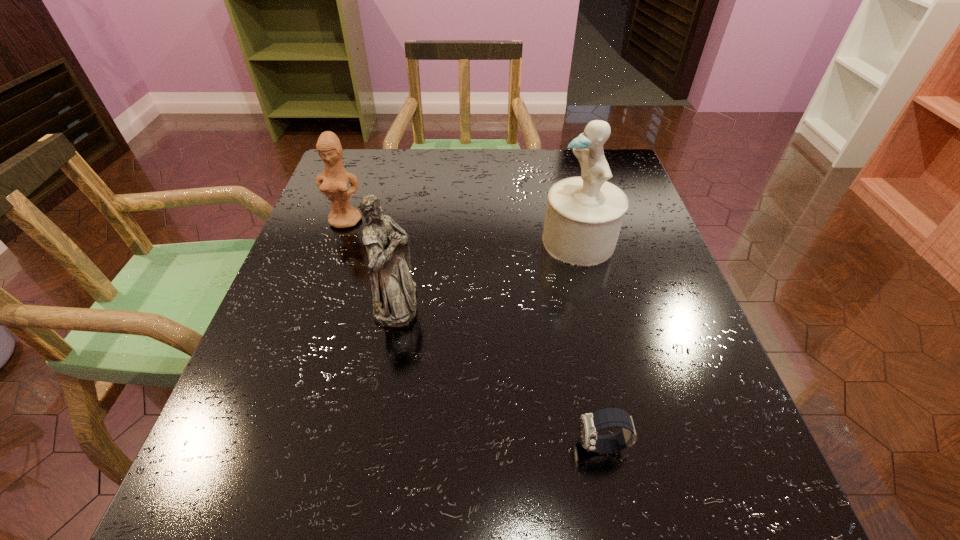
Locate an element on the screen. This screenshot has height=540, width=960. vacant area situated 0.090m on the front-facing side of the second figurine from right to left is located at coordinates (465, 302).

Locate an element on the screen. This screenshot has width=960, height=540. free space located on the front-facing side of the leftmost object is located at coordinates (332, 260).

Locate an element on the screen. The height and width of the screenshot is (540, 960). vacant space positioned on the face of the watch is located at coordinates (484, 446).

The height and width of the screenshot is (540, 960). Identify the location of free space located on the face of the watch. [x=444, y=446].

At what (x,y) coordinates should I click in order to perform the action: click on vacant space situated 0.200m on the face of the watch. Please return your answer as a coordinate pair (x, y). Looking at the image, I should click on (444, 446).

You are a GUI agent. You are given a task and a screenshot of the screen. Output one action in this format:
    pyautogui.click(x=<x>, y=<y>)
    Task: Click on the object at the left edge
    The height and width of the screenshot is (540, 960).
    Given the screenshot: What is the action you would take?
    pyautogui.click(x=333, y=183)

Find the location of a particular element. The image size is (960, 540). object located at the right edge is located at coordinates (584, 214).

Find the location of a particular element. vacant space at the far edge of the desktop is located at coordinates (559, 172).

Locate an element on the screen. free space at the near edge is located at coordinates (520, 486).

I want to click on vacant space at the left edge of the desktop, so click(336, 235).